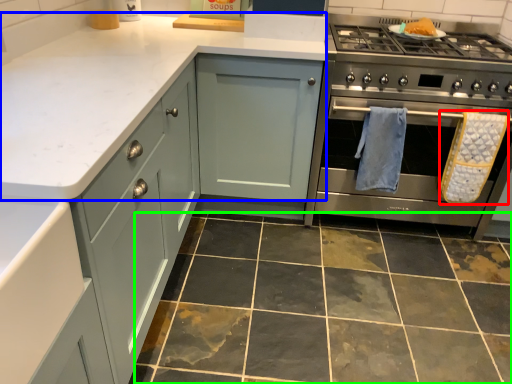
Question: Based on their relative distances, which object is farther from bath towel (highlighted by a red box)? Choose from counter top (highlighted by a blue box) and ceramic tile (highlighted by a green box).

Choices:
 (A) counter top
 (B) ceramic tile

Answer: (A)